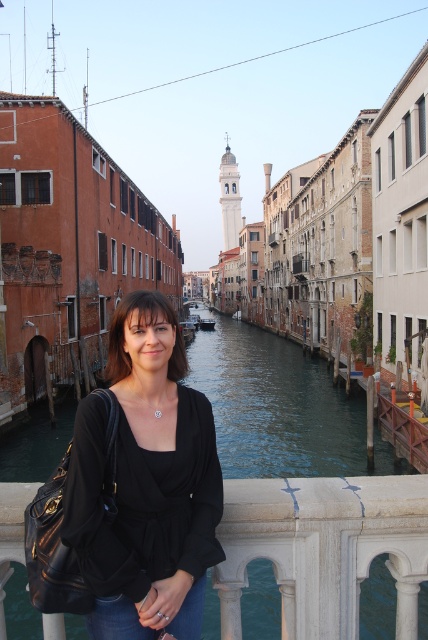
Question: Which point is closer to the camera?

Choices:
 (A) (196, 637)
 (B) (276, 376)

Answer: (A)

Question: Which object appears closest to the camera in this image?

Choices:
 (A) jeans at lower center
 (B) black matte shirt at center
 (C) greenish water at center

Answer: (B)

Question: Is black matte shirt at center below greenish water at center?

Choices:
 (A) no
 (B) yes

Answer: (A)

Question: Based on their relative distances, which object is nearer to the black matte shirt at center?

Choices:
 (A) greenish water at center
 (B) jeans at lower center

Answer: (B)

Question: Does greenish water at center have a larger size compared to jeans at lower center?

Choices:
 (A) yes
 (B) no

Answer: (A)

Question: Is black matte shirt at center above greenish water at center?

Choices:
 (A) yes
 (B) no

Answer: (A)